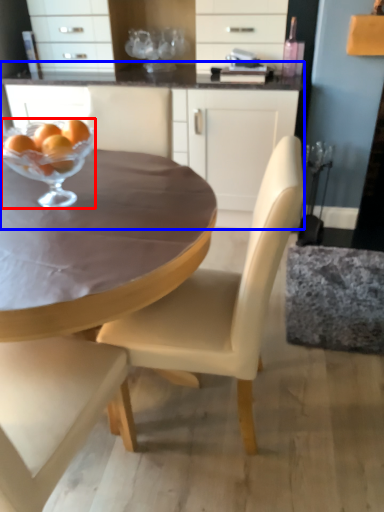
Question: Which point is closer to the camera, martini glass (highlighted by a red box) or cabinetry (highlighted by a blue box)?

Choices:
 (A) martini glass
 (B) cabinetry

Answer: (A)